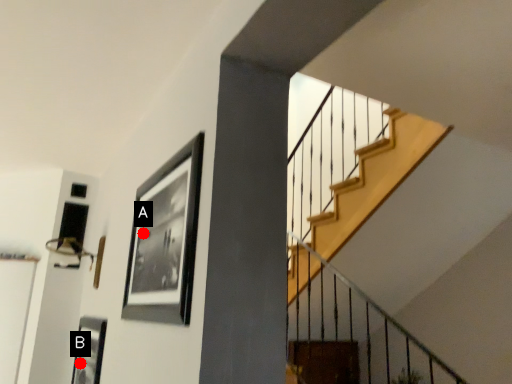
Question: Two points are circled on the image, labeled by A and B beside each circle. Which point is farther to the camera?

Choices:
 (A) A is further
 (B) B is further

Answer: (B)